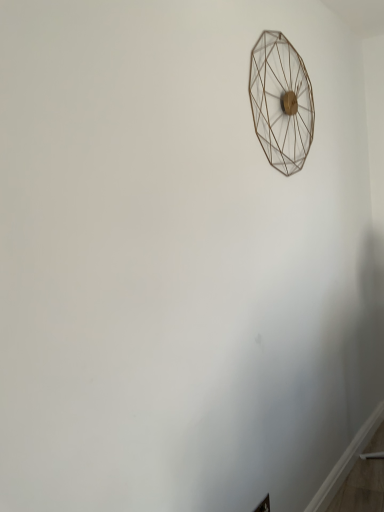
Describe the element at coordinates (281, 102) in the screenshot. Image resolution: width=384 pixels, height=512 pixels. I see `gold wire wall clock at upper center` at that location.

In order to click on gold wire wall clock at upper center in this screenshot , I will do `click(281, 102)`.

Image resolution: width=384 pixels, height=512 pixels. Find the location of `gold wire wall clock at upper center`. gold wire wall clock at upper center is located at coordinates (281, 102).